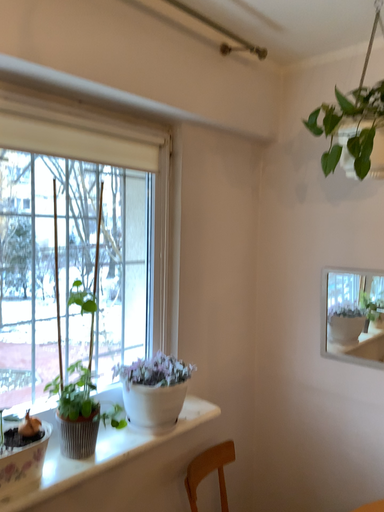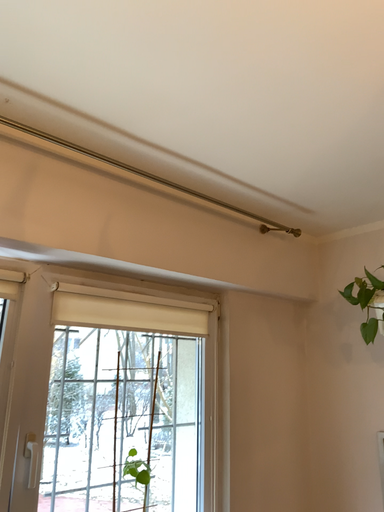
Question: How did the camera likely rotate when shooting the video?

Choices:
 (A) rotated left
 (B) rotated right

Answer: (A)